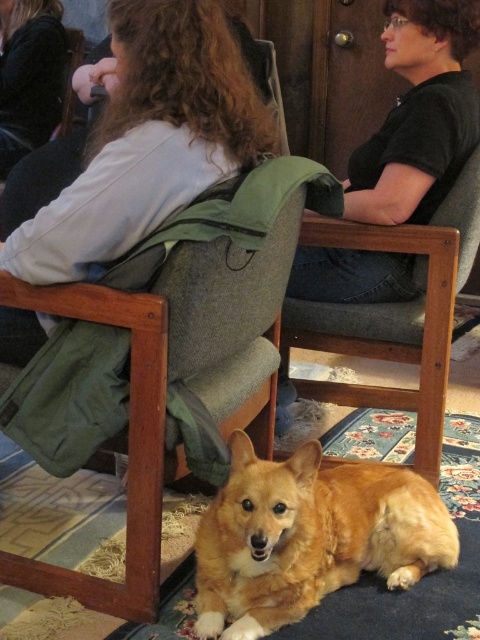
Can you confirm if golden fur dog at lower center is bigger than black cotton shirt at upper center?

No.

Who is more forward, (249,493) or (446,168)?

Point (249,493)

Image resolution: width=480 pixels, height=640 pixels. In order to click on golden fur dog at lower center in this screenshot , I will do `click(310, 538)`.

Is point (253, 620) positioned before point (9, 144)?

Yes, it is in front of point (9, 144).

Where is `golden fur dog at lower center`? This screenshot has width=480, height=640. golden fur dog at lower center is located at coordinates (310, 538).

Does black cotton shirt at upper center have a smaller size compared to light gray sweater at upper left?

Yes.

Can you confirm if black cotton shirt at upper center is shorter than light gray sweater at upper left?

Correct, black cotton shirt at upper center is not as tall as light gray sweater at upper left.

Locate an element on the screen. Image resolution: width=480 pixels, height=640 pixels. black cotton shirt at upper center is located at coordinates (419, 115).

This screenshot has width=480, height=640. In order to click on black cotton shirt at upper center in this screenshot , I will do `click(419, 115)`.